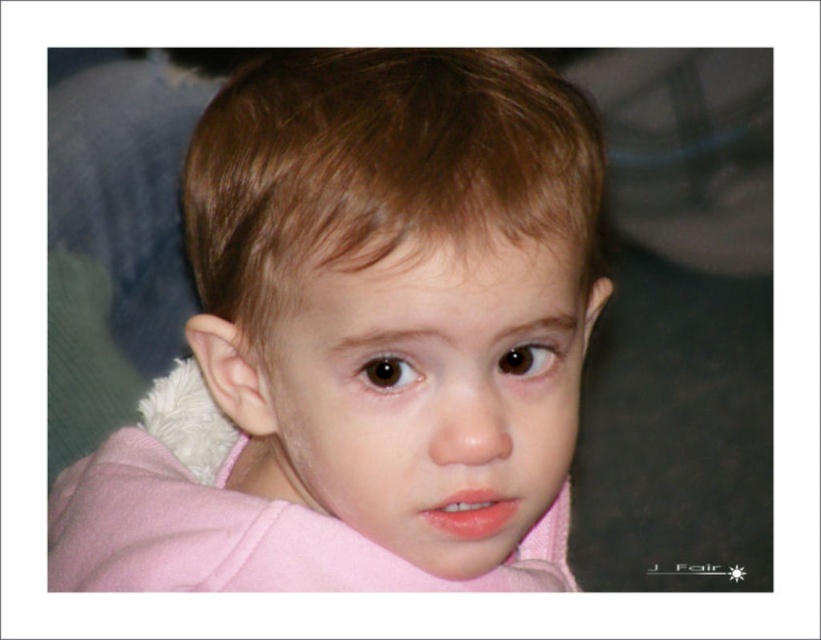
Does pink fleece at center have a lesser height compared to pink fabric at center?

No.

Does point (565, 288) lie behind point (558, 314)?

Yes, it is behind point (558, 314).

This screenshot has width=821, height=640. Identify the location of pink fleece at center. (361, 339).